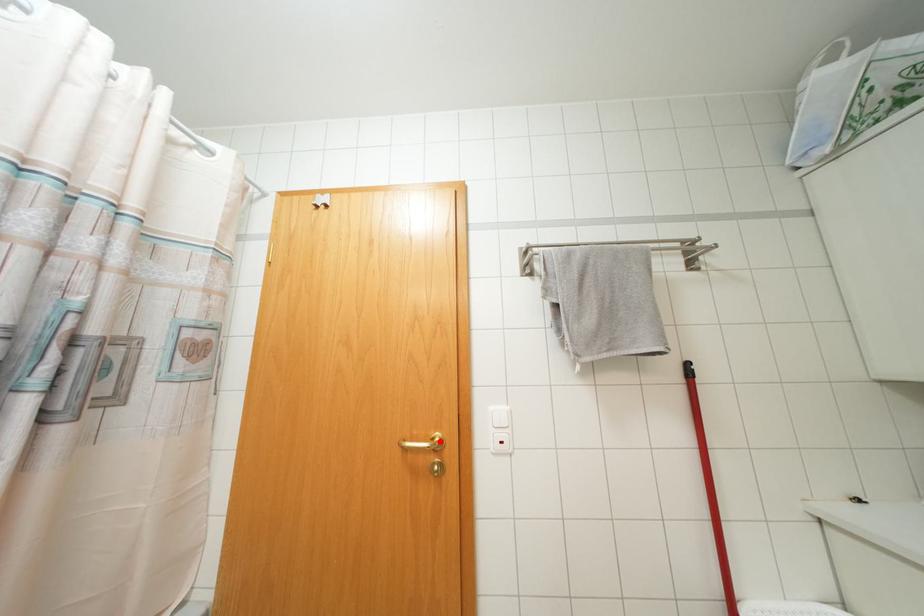
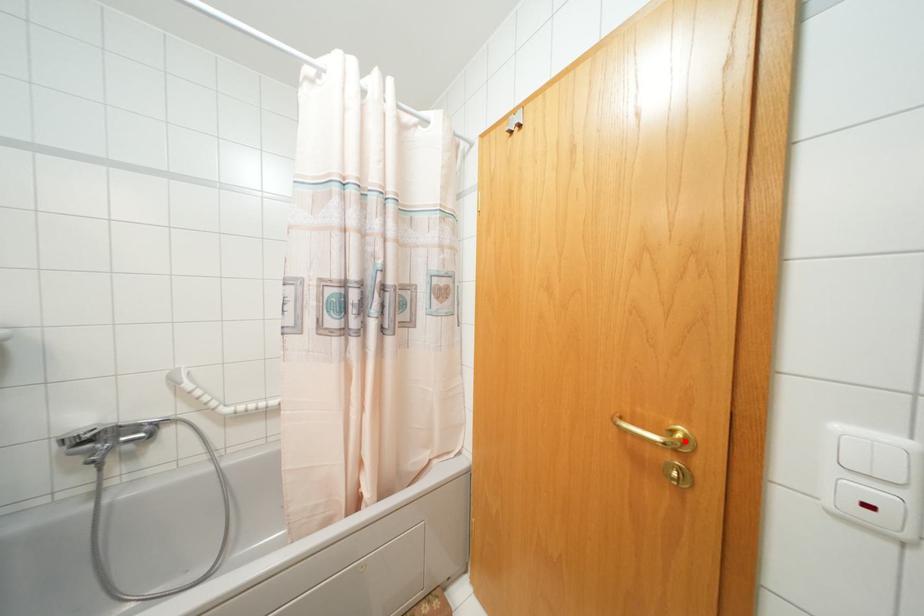
I am providing you with two images of the same scene from different viewpoints. A red point is marked on the first image and another point is marked on the second image. Do the highlighted points in image1 and image2 indicate the same real-world spot?

Yes